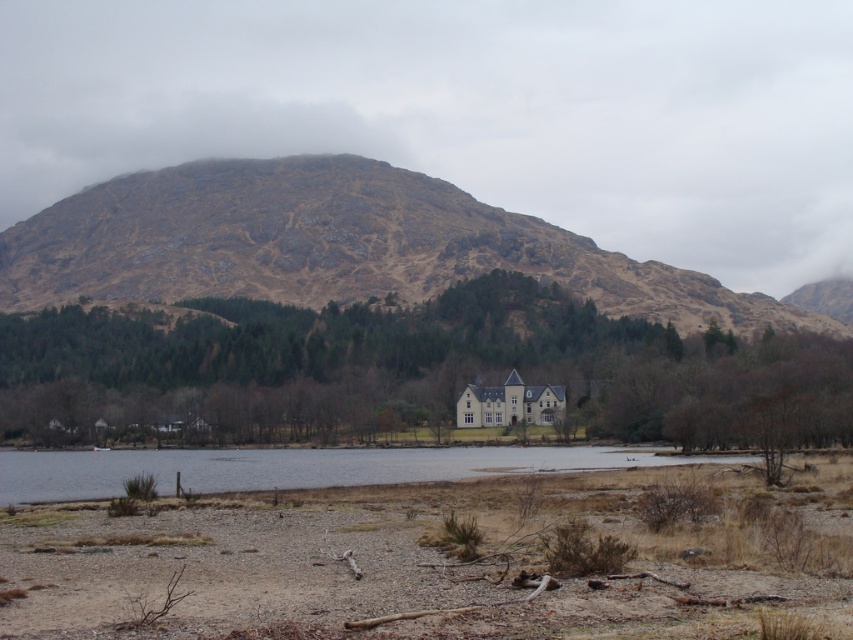
You are standing in the landscape scene and want to walk from the point closer to you to the point further away. Which path would you take between the two points, point [112,212] and point [312,476]?

You should walk from point [112,212] to point [312,476] because point [112,212] is closer to you and point [312,476] is further away, so the path goes from the closer point to the farther one.

You are standing at the edge of a beach in the image and want to know if you can easily walk across the dry sand at lower center to reach the clear water at lower center. Based on their heights, is this possible?

The dry sand at lower center is not as tall as the clear water at lower center, so it is possible to walk across the dry sand at lower center to reach the clear water at lower center since the sand is lower in elevation.

You are standing at point (334, 244) in the image. What is the terrain like at your current location?

The terrain at point (334, 244) is rugged brown rock.